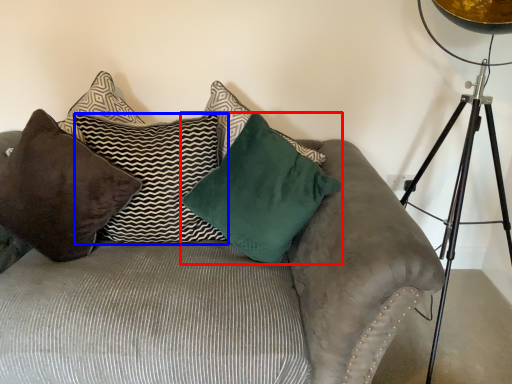
Question: Which of the following is the farthest to the observer, pillow (highlighted by a red box) or pillow (highlighted by a blue box)?

Choices:
 (A) pillow
 (B) pillow

Answer: (B)